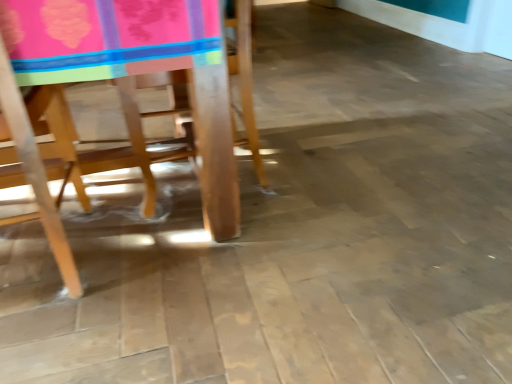
Question: Based on their positions, is wooden chair at left, the 2th chair from the left, located to the left or right of wooden chair at left, positioned as the 2th chair in right-to-left order?

Choices:
 (A) left
 (B) right

Answer: (B)

Question: Considering the positions of point (203, 52) and point (24, 114), is point (203, 52) closer or farther from the camera than point (24, 114)?

Choices:
 (A) farther
 (B) closer

Answer: (B)

Question: From a real-world perspective, is wooden chair at left, which appears as the 1th chair when viewed from the right, positioned above or below wooden chair at left, positioned as the 2th chair in right-to-left order?

Choices:
 (A) below
 (B) above

Answer: (B)

Question: Is wooden chair at left, the 1th chair from the left, wider or thinner than wooden chair at left, which appears as the 1th chair when viewed from the right?

Choices:
 (A) thin
 (B) wide

Answer: (A)

Question: Based on their sizes in the image, would you say wooden chair at left, the 1th chair from the left, is bigger or smaller than wooden chair at left, the 2th chair from the left?

Choices:
 (A) small
 (B) big

Answer: (A)

Question: Is wooden chair at left, the 1th chair from the left, to the left or to the right of wooden chair at left, the 2th chair from the left, in the image?

Choices:
 (A) right
 (B) left

Answer: (B)

Question: Would you say wooden chair at left, positioned as the 2th chair in right-to-left order, is inside or outside wooden chair at left, which appears as the 1th chair when viewed from the right?

Choices:
 (A) outside
 (B) inside

Answer: (B)